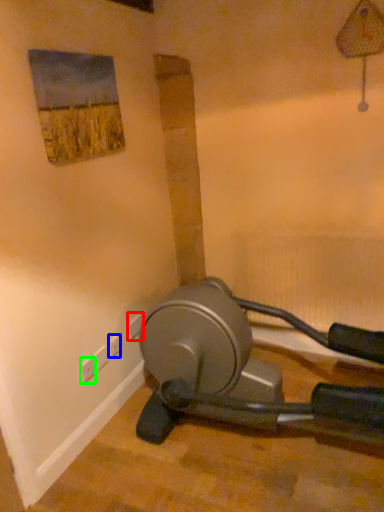
Question: Which is nearer to the electric outlet (highlighted by a red box)? electric outlet (highlighted by a blue box) or electric outlet (highlighted by a green box).

Choices:
 (A) electric outlet
 (B) electric outlet

Answer: (A)